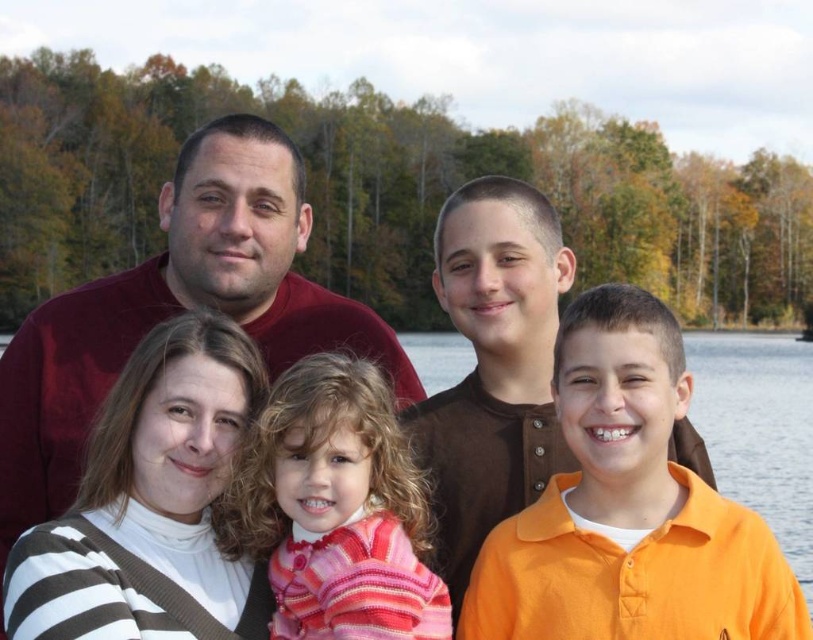
You are a photographer trying to capture a group shot of the family. You notice the striped knit sweater at center and the orange shirt at center. Which clothing item should you focus on to ensure it stands out more in the photo?

The orange shirt at center occupies more space than the striped knit sweater at center, so focusing on the orange shirt at center will make it stand out more in the photo.

You are a photographer standing at the edge of the lake. You want to take a closeup photo of the striped knit sweater at center. Can you estimate if you can focus on it clearly without moving closer than 17 meters?

The striped knit sweater at center is 17.58 meters away from the camera. Since the minimum focusing distance is 17 meters, you can focus on it clearly without moving closer.